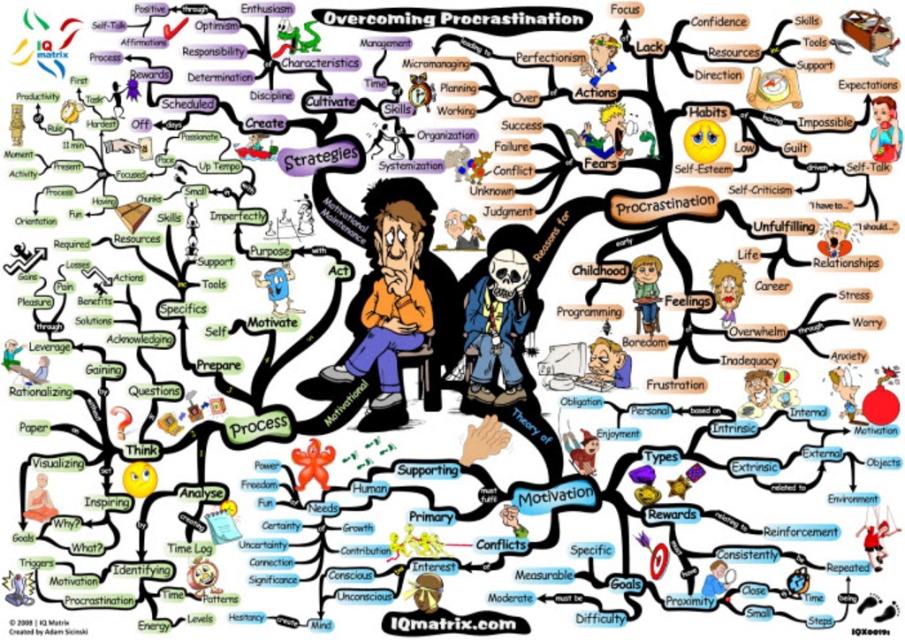
You are standing in front of the infographic and notice the wooden chair at center and the cartoon woman at center. Which object is closer to you?

The wooden chair at center is closer to you because it is further to the viewer than the cartoon woman at center.

In the infographic about overcoming procrastination, there is a wooden chair at center and a matte orange monk at lower left. Which object is larger in size?

The wooden chair at center is bigger than the matte orange monk at lower left.

You are looking at the infographic and notice two points marked in the scene. Which point is closer to you, point (648,276) or point (722,285)?

Point (648,276) is further to the camera than point (722,285), so point (722,285) is closer to you.